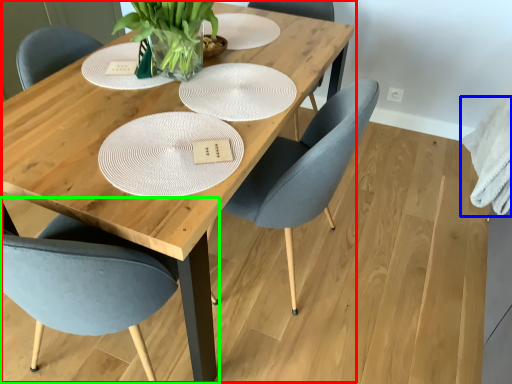
Question: Which is nearer to the table (highlighted by a red box)? cloth (highlighted by a blue box) or chair (highlighted by a green box).

Choices:
 (A) cloth
 (B) chair

Answer: (B)